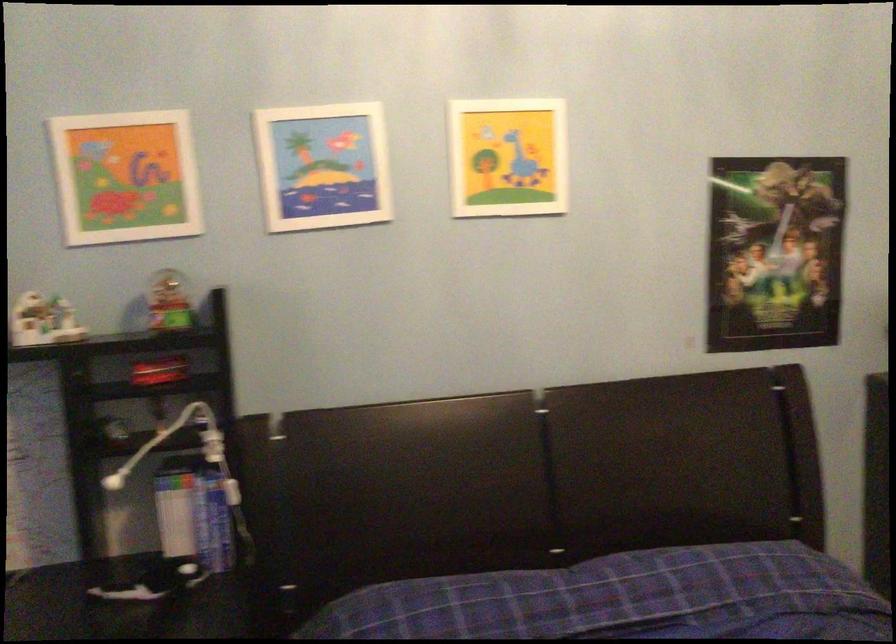
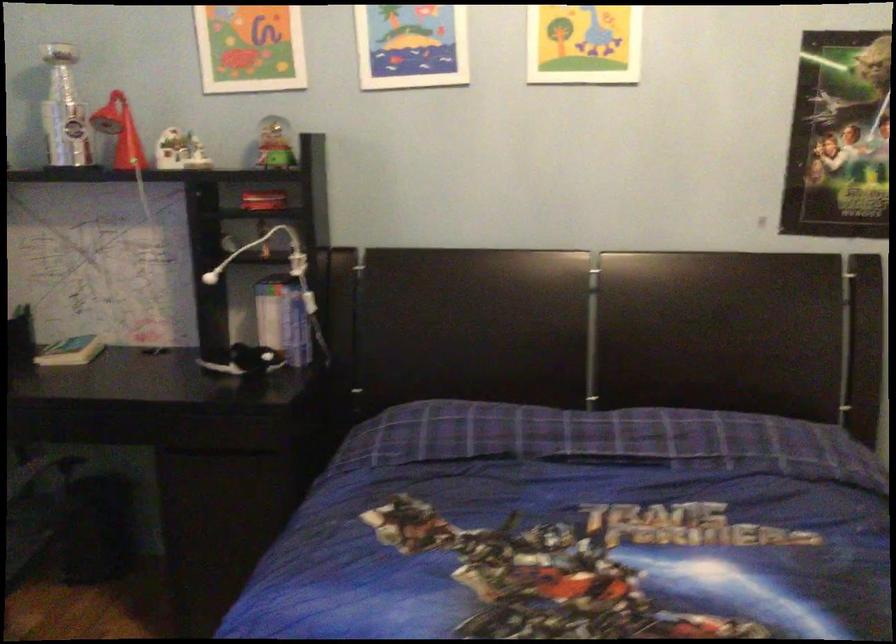
Find the pixel in the second image that matches the point at 168,306 in the first image.

(273, 144)